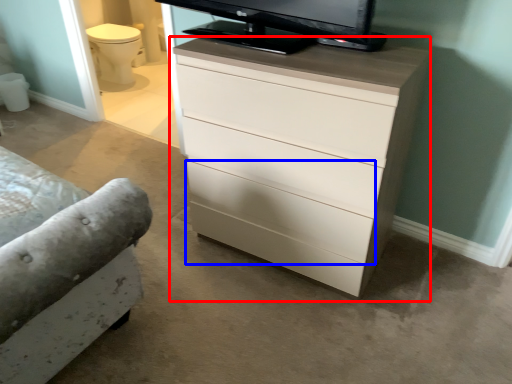
Question: Which object appears farthest to the camera in this image, chest of drawers (highlighted by a red box) or drawer (highlighted by a blue box)?

Choices:
 (A) chest of drawers
 (B) drawer

Answer: (B)